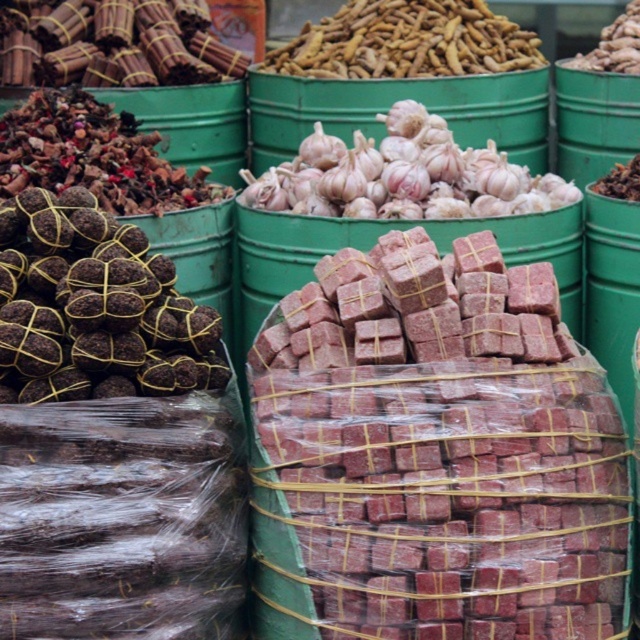
Question: Which point is closer to the camera taking this photo?

Choices:
 (A) (417, 179)
 (B) (188, 176)
 (C) (616, 64)
 (D) (204, 67)

Answer: (A)

Question: Is brown woven sticks at upper left smaller than smooth brown nuts at upper center?

Choices:
 (A) yes
 (B) no

Answer: (B)

Question: Considering the real-world distances, which object is closest to the smooth brown nuts at upper center?

Choices:
 (A) red brick at center
 (B) brown woven sticks at upper left
 (C) brown woven balls at left

Answer: (B)

Question: Where is white matte garlic at center located in relation to brown woven sticks at upper left in the image?

Choices:
 (A) below
 (B) above

Answer: (A)

Question: Does brown textured garlic at center have a lesser width compared to smooth brown nuts at upper center?

Choices:
 (A) yes
 (B) no

Answer: (B)

Question: Which of the following is the farthest from the observer?

Choices:
 (A) (29, 124)
 (B) (388, 131)
 (C) (163, 387)

Answer: (B)